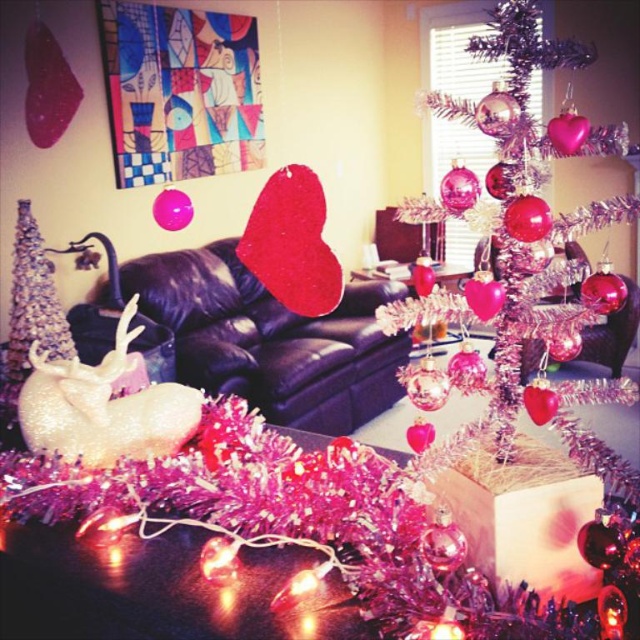
Question: Which of the following is the closest to the observer?

Choices:
 (A) (509, 220)
 (B) (17, 326)

Answer: (A)

Question: Does shiny silver christmas tree at center appear over shiny silver christmas tree at left?

Choices:
 (A) yes
 (B) no

Answer: (A)

Question: Is shiny silver christmas tree at center to the left of shiny silver christmas tree at left from the viewer's perspective?

Choices:
 (A) yes
 (B) no

Answer: (B)

Question: Where is shiny silver christmas tree at center located in relation to shiny silver christmas tree at left in the image?

Choices:
 (A) below
 (B) above

Answer: (B)

Question: Among these points, which one is nearest to the camera?

Choices:
 (A) (44, 323)
 (B) (490, 218)

Answer: (B)

Question: Which point appears closest to the camera in this image?

Choices:
 (A) (529, 310)
 (B) (67, 355)

Answer: (A)